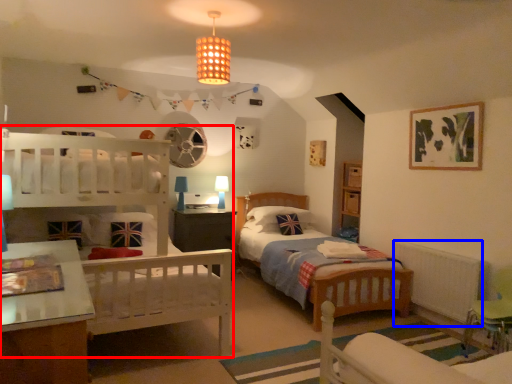
Question: Which of the following is the farthest to the observer, bunk bed (highlighted by a red box) or radiator (highlighted by a blue box)?

Choices:
 (A) bunk bed
 (B) radiator

Answer: (B)